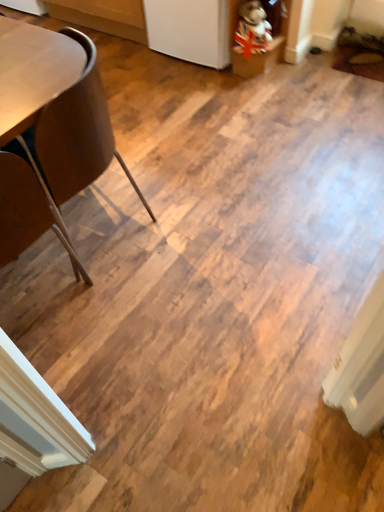
Based on the photo, in order to face brown leather chair at left, acting as the 2th chair starting from the top, should I rotate leftwards or rightwards?

You should look left and rotate roughly 25.814 degrees.

This screenshot has width=384, height=512. What do you see at coordinates (252, 30) in the screenshot?
I see `union jack plush at upper right` at bounding box center [252, 30].

This screenshot has width=384, height=512. I want to click on brown leather chair at left, positioned as the 2th chair in bottom-to-top order, so click(73, 143).

Where is `brown leather chair at left, acting as the 2th chair starting from the top`? The width and height of the screenshot is (384, 512). brown leather chair at left, acting as the 2th chair starting from the top is located at coordinates (26, 213).

Is union jack plush at upper right aimed at brown leather chair at left, positioned as the 2th chair in bottom-to-top order?

Yes, union jack plush at upper right is aimed at brown leather chair at left, positioned as the 2th chair in bottom-to-top order.

Looking at this image, in terms of height, does union jack plush at upper right look taller or shorter compared to brown leather chair at left, which is counted as the 1th chair, starting from the top?

Considering their sizes, union jack plush at upper right has less height than brown leather chair at left, which is counted as the 1th chair, starting from the top.

Starting from the union jack plush at upper right, which chair is the 1st one in front? Please provide its 2D coordinates.

[(73, 143)]

From a real-world perspective, which is physically below, brown leather chair at left, which is counted as the first chair, starting from the bottom, or union jack plush at upper right?

union jack plush at upper right, from a real-world perspective.

This screenshot has width=384, height=512. Find the location of `toy that appears above the brown leather chair at left, which is counted as the first chair, starting from the bottom (from the image's perspective)`. toy that appears above the brown leather chair at left, which is counted as the first chair, starting from the bottom (from the image's perspective) is located at coordinates 252,30.

Could union jack plush at upper right be considered to be inside brown leather chair at left, acting as the 2th chair starting from the top?

No, brown leather chair at left, acting as the 2th chair starting from the top, does not contain union jack plush at upper right.

From a real-world perspective, does brown leather chair at left, which is counted as the first chair, starting from the bottom, stand above brown leather chair at left, positioned as the 2th chair in bottom-to-top order?

Indeed, from a real-world perspective, brown leather chair at left, which is counted as the first chair, starting from the bottom, stands above brown leather chair at left, positioned as the 2th chair in bottom-to-top order.

Is brown leather chair at left, which is counted as the first chair, starting from the bottom, outside of brown leather chair at left, positioned as the 2th chair in bottom-to-top order?

brown leather chair at left, which is counted as the first chair, starting from the bottom, is positioned outside brown leather chair at left, positioned as the 2th chair in bottom-to-top order.

From the image's perspective, would you say brown leather chair at left, acting as the 2th chair starting from the top, is positioned over brown leather chair at left, which is counted as the 1th chair, starting from the top?

Incorrect, from the image's perspective, brown leather chair at left, acting as the 2th chair starting from the top, is lower than brown leather chair at left, which is counted as the 1th chair, starting from the top.

Is the surface of brown leather chair at left, acting as the 2th chair starting from the top, in direct contact with brown leather chair at left, positioned as the 2th chair in bottom-to-top order?

No, brown leather chair at left, acting as the 2th chair starting from the top, is not touching brown leather chair at left, positioned as the 2th chair in bottom-to-top order.

Is union jack plush at upper right with brown leather chair at left, acting as the 2th chair starting from the top?

union jack plush at upper right is not next to brown leather chair at left, acting as the 2th chair starting from the top, and they're not touching.

Identify the location of toy located behind the brown leather chair at left, acting as the 2th chair starting from the top. (252, 30).

In the scene shown: Who is smaller, union jack plush at upper right or brown leather chair at left, acting as the 2th chair starting from the top?

union jack plush at upper right is smaller.

Is union jack plush at upper right not within brown leather chair at left, acting as the 2th chair starting from the top?

Yes, union jack plush at upper right is outside of brown leather chair at left, acting as the 2th chair starting from the top.

Considering the sizes of objects brown leather chair at left, positioned as the 2th chair in bottom-to-top order, and brown leather chair at left, acting as the 2th chair starting from the top, in the image provided, who is wider, brown leather chair at left, positioned as the 2th chair in bottom-to-top order, or brown leather chair at left, acting as the 2th chair starting from the top,?

Wider between the two is brown leather chair at left, positioned as the 2th chair in bottom-to-top order.

You are a GUI agent. You are given a task and a screenshot of the screen. Output one action in this format:
    pyautogui.click(x=<x>, y=<y>)
    Task: Click on the chair on the right of the brown leather chair at left, which is counted as the first chair, starting from the bottom
    Image resolution: width=384 pixels, height=512 pixels.
    Given the screenshot: What is the action you would take?
    pyautogui.click(x=73, y=143)

From a real-world perspective, which object stands above the other?

brown leather chair at left, which is counted as the first chair, starting from the bottom.

Considering the positions of objects brown leather chair at left, positioned as the 2th chair in bottom-to-top order, and brown leather chair at left, acting as the 2th chair starting from the top, in the image provided, who is in front, brown leather chair at left, positioned as the 2th chair in bottom-to-top order, or brown leather chair at left, acting as the 2th chair starting from the top,?

brown leather chair at left, acting as the 2th chair starting from the top.

You are a GUI agent. You are given a task and a screenshot of the screen. Output one action in this format:
    pyautogui.click(x=<x>, y=<y>)
    Task: Click on the 1st chair directly above the union jack plush at upper right (from a real-world perspective)
    
    Given the screenshot: What is the action you would take?
    pyautogui.click(x=73, y=143)

Looking at this image, from the image's perspective, is brown leather chair at left, positioned as the 2th chair in bottom-to-top order, over union jack plush at upper right?

Incorrect, from the image's perspective, brown leather chair at left, positioned as the 2th chair in bottom-to-top order, is lower than union jack plush at upper right.

Could you tell me if brown leather chair at left, which is counted as the 1th chair, starting from the top, is facing union jack plush at upper right?

No, brown leather chair at left, which is counted as the 1th chair, starting from the top, is not oriented towards union jack plush at upper right.

Which is more to the left, brown leather chair at left, which is counted as the 1th chair, starting from the top, or union jack plush at upper right?

Positioned to the left is brown leather chair at left, which is counted as the 1th chair, starting from the top.

Starting from the union jack plush at upper right, which chair is the 1st one in front? Please provide its 2D coordinates.

[(73, 143)]

At what (x,y) coordinates should I click in order to perform the action: click on toy that is above the brown leather chair at left, acting as the 2th chair starting from the top (from the image's perspective). Please return your answer as a coordinate pair (x, y). Looking at the image, I should click on (252, 30).

From the image, which object appears to be nearer to brown leather chair at left, which is counted as the 1th chair, starting from the top, union jack plush at upper right or brown leather chair at left, acting as the 2th chair starting from the top?

The object closer to brown leather chair at left, which is counted as the 1th chair, starting from the top, is brown leather chair at left, acting as the 2th chair starting from the top.

Based on the photo, looking at the image, which one is located closer to union jack plush at upper right, brown leather chair at left, acting as the 2th chair starting from the top, or brown leather chair at left, which is counted as the 1th chair, starting from the top?

brown leather chair at left, which is counted as the 1th chair, starting from the top, lies closer to union jack plush at upper right than the other object.

Looking at the image, which one is located further to brown leather chair at left, acting as the 2th chair starting from the top, union jack plush at upper right or brown leather chair at left, which is counted as the 1th chair, starting from the top?

Result: union jack plush at upper right lies further to brown leather chair at left, acting as the 2th chair starting from the top, than the other object.

From the image, which object appears to be farther from brown leather chair at left, positioned as the 2th chair in bottom-to-top order, brown leather chair at left, which is counted as the first chair, starting from the bottom, or union jack plush at upper right?

union jack plush at upper right.

Looking at the image, which one is located further to brown leather chair at left, acting as the 2th chair starting from the top, brown leather chair at left, which is counted as the 1th chair, starting from the top, or union jack plush at upper right?

union jack plush at upper right is further to brown leather chair at left, acting as the 2th chair starting from the top.

Based on their spatial positions, is brown leather chair at left, positioned as the 2th chair in bottom-to-top order, or brown leather chair at left, which is counted as the first chair, starting from the bottom, further from union jack plush at upper right?

Based on the image, brown leather chair at left, which is counted as the first chair, starting from the bottom, appears to be further to union jack plush at upper right.

What are the coordinates of `chair located between brown leather chair at left, which is counted as the first chair, starting from the bottom, and union jack plush at upper right in the depth direction` in the screenshot? It's located at (73, 143).